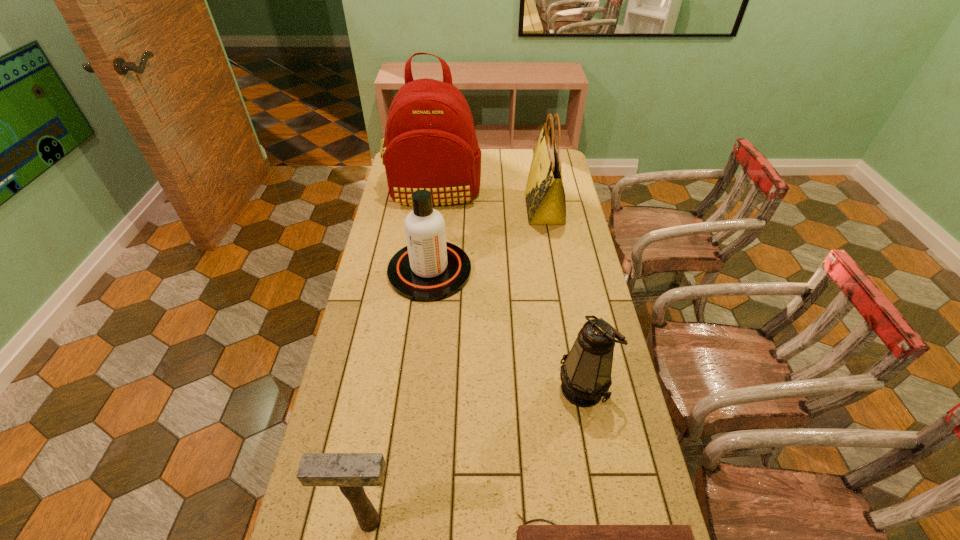
Locate an element on the screen. This screenshot has width=960, height=540. the tallest object is located at coordinates (430, 143).

This screenshot has width=960, height=540. What are the coordinates of `tote bag` in the screenshot? It's located at (545, 198).

Image resolution: width=960 pixels, height=540 pixels. In order to click on the fourth nearest object in this screenshot , I will do `click(428, 269)`.

Locate an element on the screen. mallet is located at coordinates (350, 471).

This screenshot has width=960, height=540. Identify the location of oil lamp. (585, 373).

The width and height of the screenshot is (960, 540). In order to click on free region located 0.250m on the front-facing side of the tallest object in this screenshot , I will do (426, 250).

The image size is (960, 540). I want to click on vacant space located on the front-facing side of the tote bag, so click(446, 209).

Locate an element on the screen. The height and width of the screenshot is (540, 960). free space located 0.360m on the front-facing side of the tote bag is located at coordinates (444, 209).

Where is `vacant space located 0.170m on the front-facing side of the tote bag`? The height and width of the screenshot is (540, 960). vacant space located 0.170m on the front-facing side of the tote bag is located at coordinates (488, 209).

At what (x,y) coordinates should I click in order to perform the action: click on free spot located 0.320m on the right of the cleansing agent. Please return your answer as a coordinate pair (x, y). Looking at the image, I should click on (557, 271).